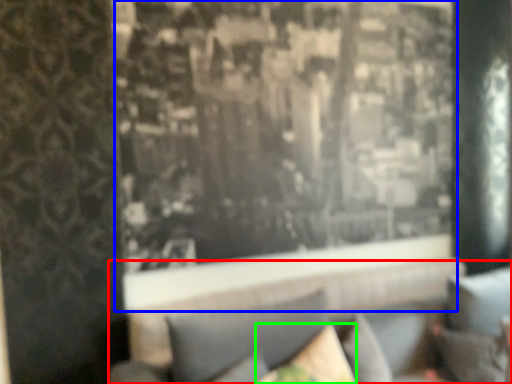
Question: Which is farther away from couch (highlighted by a red box)? window (highlighted by a blue box) or pillow (highlighted by a green box)?

Choices:
 (A) window
 (B) pillow

Answer: (A)